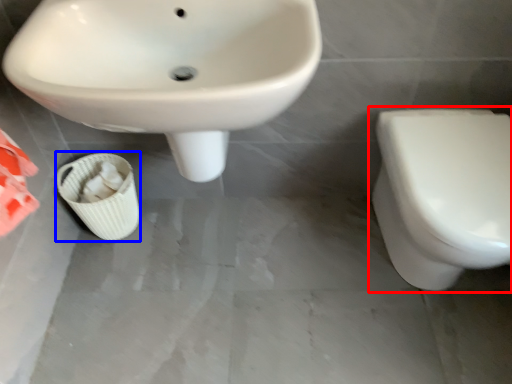
Question: Which object appears farthest to the camera in this image, toilet (highlighted by a red box) or potty (highlighted by a blue box)?

Choices:
 (A) toilet
 (B) potty

Answer: (B)